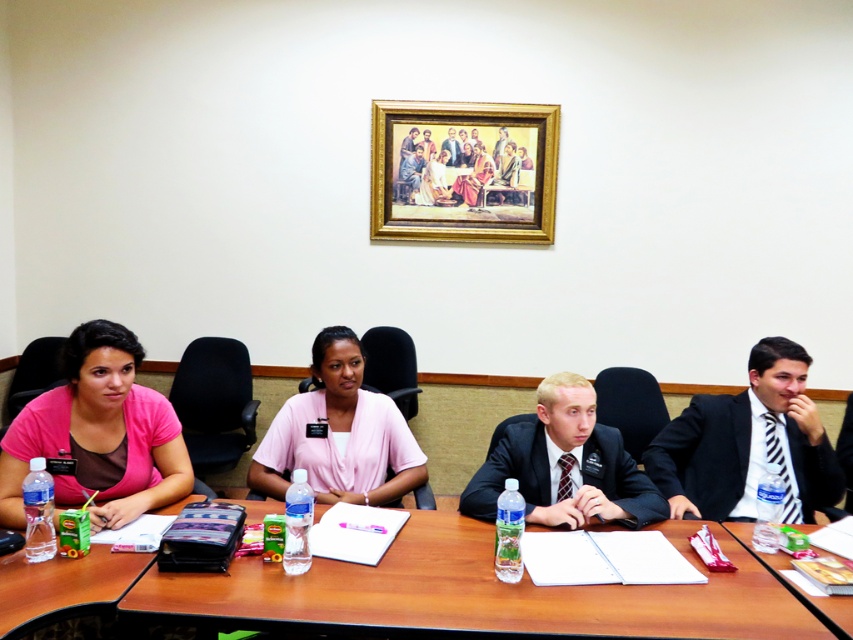
Can you confirm if brown wooden table at center is thinner than gold-framed painting at upper center?

No.

Which is more to the right, brown wooden table at center or gold-framed painting at upper center?

From the viewer's perspective, gold-framed painting at upper center appears more on the right side.

Describe the element at coordinates (477, 593) in the screenshot. The height and width of the screenshot is (640, 853). I see `brown wooden table at center` at that location.

The height and width of the screenshot is (640, 853). In order to click on brown wooden table at center in this screenshot , I will do `click(477, 593)`.

In the scene shown: Which is more to the left, dark suit at center or wooden table at lower right?

Positioned to the left is dark suit at center.

Can you confirm if dark suit at center is taller than wooden table at lower right?

Yes.

Is point (555, 445) closer to camera compared to point (848, 625)?

No, it is behind (848, 625).

This screenshot has width=853, height=640. I want to click on dark suit at center, so click(x=566, y=465).

Can you confirm if gold-framed painting at upper center is shorter than pink matte shirt at left?

Incorrect, gold-framed painting at upper center's height does not fall short of pink matte shirt at left's.

Is point (370, 156) positioned behind point (106, 454)?

Yes.

This screenshot has width=853, height=640. What are the coordinates of `gold-framed painting at upper center` in the screenshot? It's located at (463, 172).